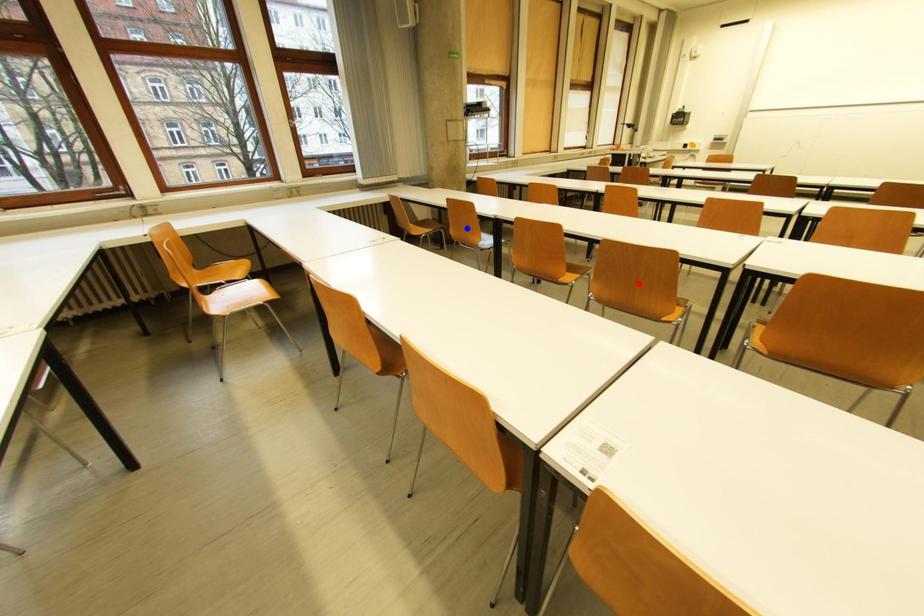
Order these from farthest to nearest:
orange point, red point, blue point

1. orange point
2. blue point
3. red point